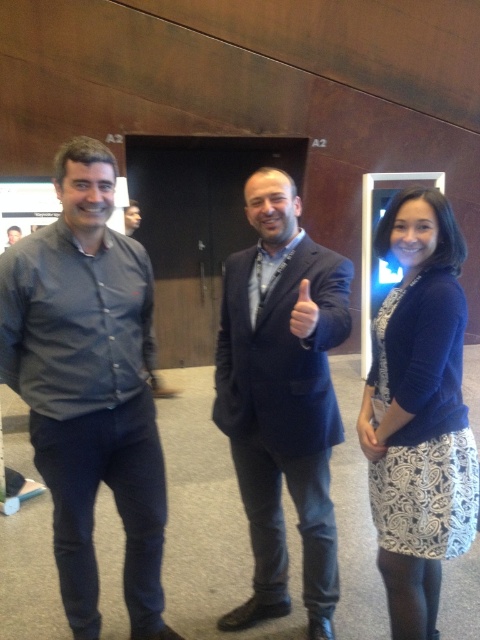
You are standing at the entrance of the conference room and want to greet both the dark gray shirt at left and the dark blue suit at center. If you walk straight ahead, which one will you approach first?

The dark gray shirt at left is 16.18 inches away from the dark blue suit at center. Since you are at the entrance, the dark gray shirt at left is closer to you, so you will approach the dark gray shirt at left first.

Consider the image. You are at a conference and need to approach the two people wearing dark gray shirt at left and matte black shirt at left. Which one is closer to you if you are standing directly in front of them?

The dark gray shirt at left is positioned under matte black shirt at left, so the dark gray shirt at left is closer to you.